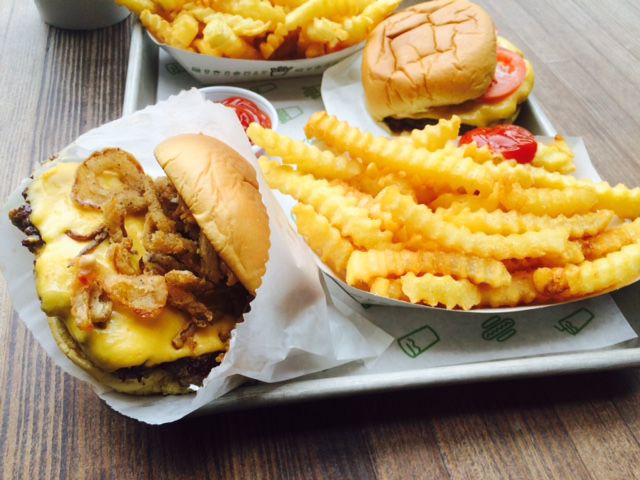
Find the location of a particular element. Image resolution: width=640 pixels, height=480 pixels. cup is located at coordinates (91, 5).